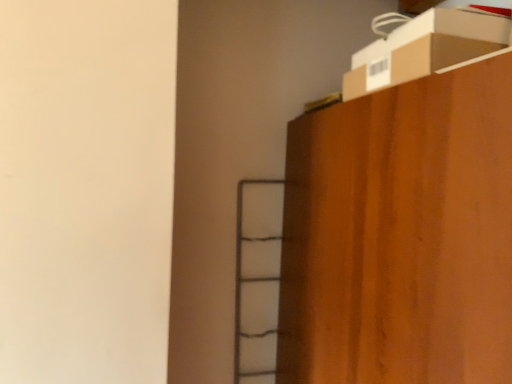
Question: Can you confirm if brown cardboard box at upper right is smaller than wooden cabinet at upper right?

Choices:
 (A) yes
 (B) no

Answer: (A)

Question: From the image's perspective, is brown cardboard box at upper right under wooden cabinet at upper right?

Choices:
 (A) no
 (B) yes

Answer: (A)

Question: Can you confirm if brown cardboard box at upper right is taller than wooden cabinet at upper right?

Choices:
 (A) yes
 (B) no

Answer: (B)

Question: From the image's perspective, is brown cardboard box at upper right over wooden cabinet at upper right?

Choices:
 (A) no
 (B) yes

Answer: (B)

Question: Does brown cardboard box at upper right lie in front of wooden cabinet at upper right?

Choices:
 (A) no
 (B) yes

Answer: (A)

Question: Is brown cardboard box at upper right wider than wooden cabinet at upper right?

Choices:
 (A) no
 (B) yes

Answer: (A)

Question: Is wooden cabinet at upper right positioned in front of brown cardboard box at upper right?

Choices:
 (A) no
 (B) yes

Answer: (B)

Question: From the image's perspective, is wooden cabinet at upper right below brown cardboard box at upper right?

Choices:
 (A) no
 (B) yes

Answer: (B)

Question: From a real-world perspective, does wooden cabinet at upper right stand above brown cardboard box at upper right?

Choices:
 (A) no
 (B) yes

Answer: (A)

Question: Can you confirm if wooden cabinet at upper right is positioned to the left of brown cardboard box at upper right?

Choices:
 (A) yes
 (B) no

Answer: (B)

Question: Is the position of wooden cabinet at upper right more distant than that of brown cardboard box at upper right?

Choices:
 (A) yes
 (B) no

Answer: (B)

Question: Considering the relative sizes of wooden cabinet at upper right and brown cardboard box at upper right in the image provided, is wooden cabinet at upper right bigger than brown cardboard box at upper right?

Choices:
 (A) no
 (B) yes

Answer: (B)

Question: Considering their positions, is brown cardboard box at upper right located in front of or behind wooden cabinet at upper right?

Choices:
 (A) behind
 (B) front

Answer: (A)